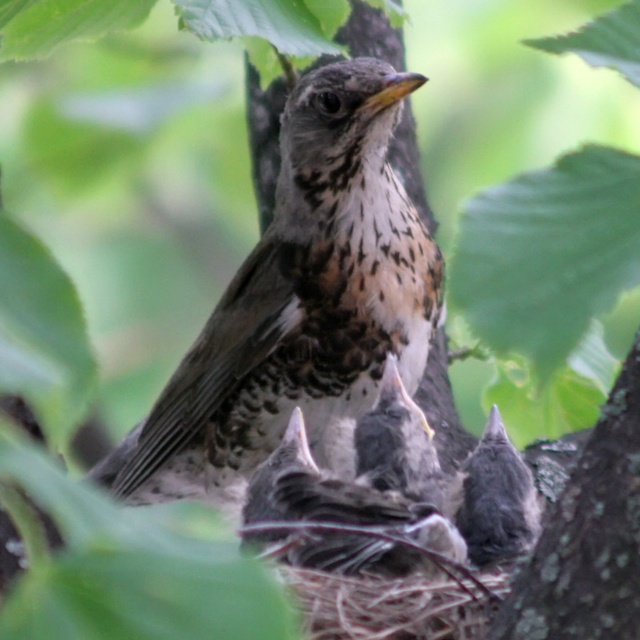
Is speckled feathered bird at center closer to camera compared to gray speckled feathers at center?

That is False.

Is point (420, 291) farther from camera compared to point (518, 504)?

Yes, point (420, 291) is behind point (518, 504).

What do you see at coordinates (300, 298) in the screenshot? I see `speckled feathered bird at center` at bounding box center [300, 298].

Find the location of a particular element. speckled feathered bird at center is located at coordinates (300, 298).